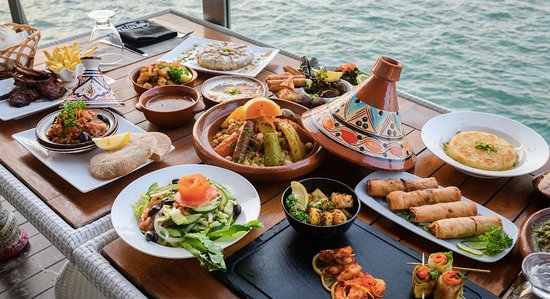
This screenshot has width=550, height=299. In order to click on napkin in this screenshot , I will do `click(148, 50)`.